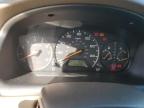
Find the location of a particular element. Image resolution: width=144 pixels, height=108 pixels. light is located at coordinates (21, 81).